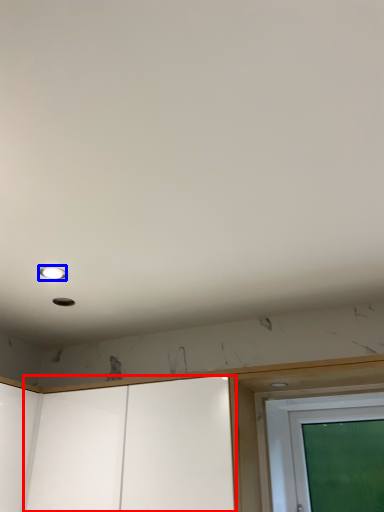
Question: Which of the following is the closest to the observer, screen door (highlighted by a red box) or droplight (highlighted by a blue box)?

Choices:
 (A) screen door
 (B) droplight

Answer: (A)